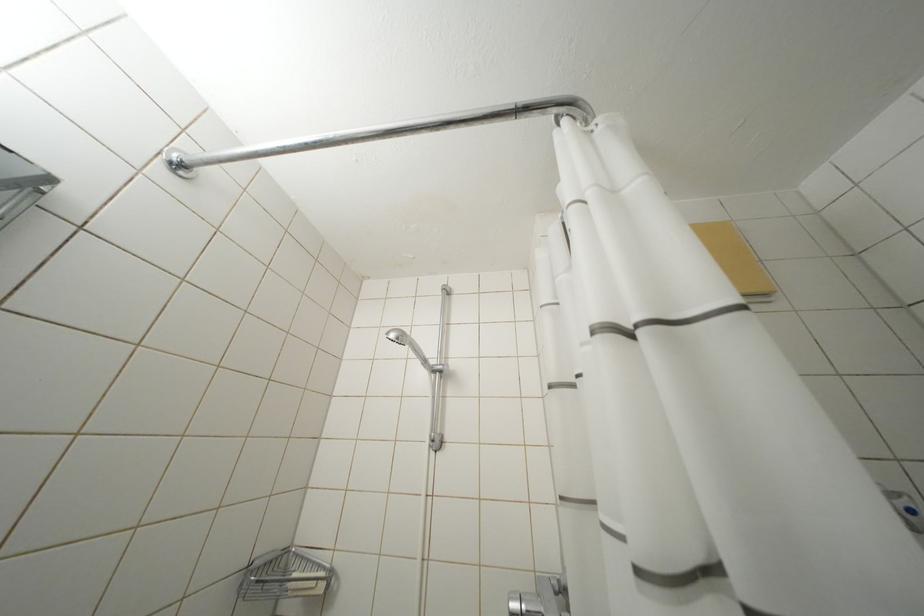
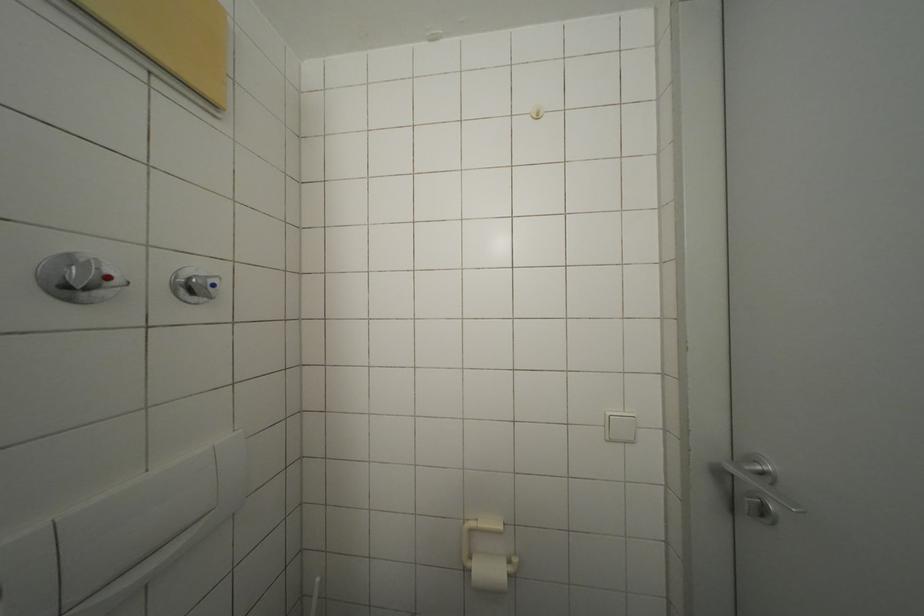
Question: How did the camera likely rotate?

Choices:
 (A) Left
 (B) Right
 (C) Up
 (D) Down

Answer: (B)